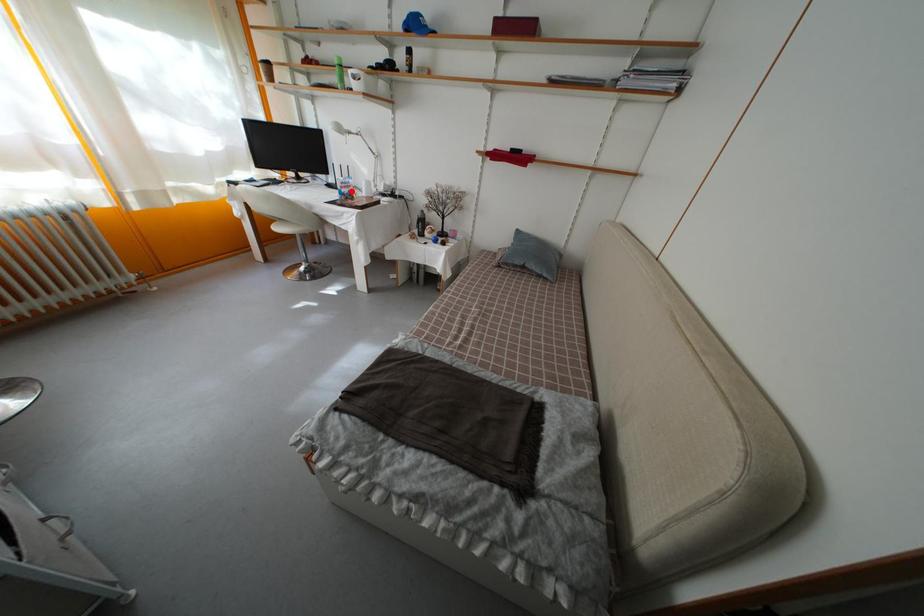
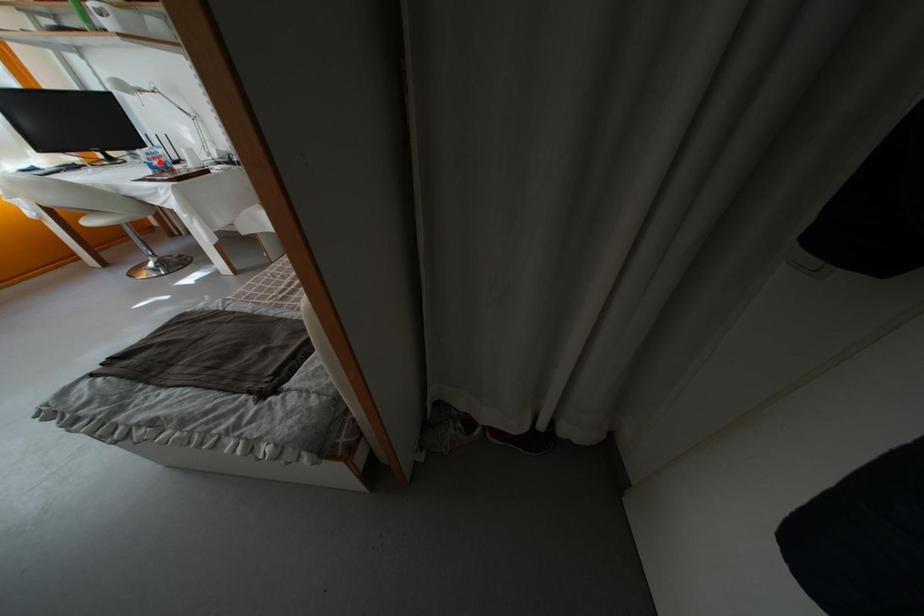
I am providing you with two images of the same scene from different viewpoints. A red point is marked on the first image and another point is marked on the second image. Does the point marked in image1 correspond to the same location as the one in image2?

Yes